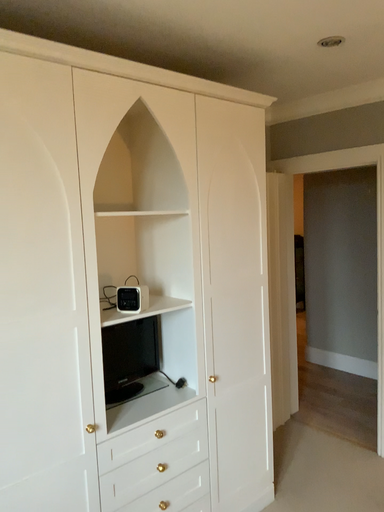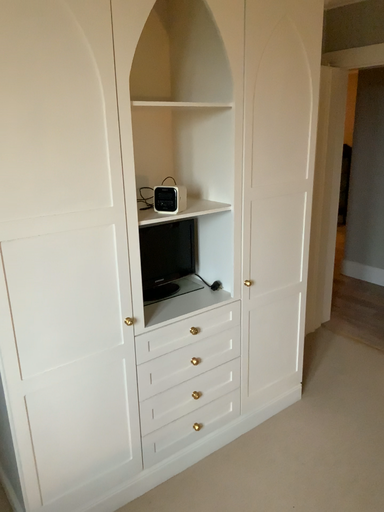
Question: How did the camera likely rotate when shooting the video?

Choices:
 (A) rotated upward
 (B) rotated downward

Answer: (B)